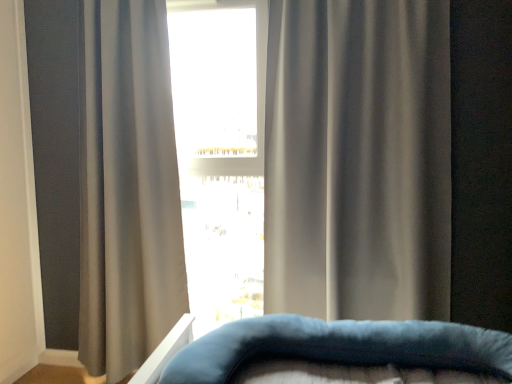
Question: Is satin gray curtain at center, which ranks as the second curtain in left-to-right order, oriented away from velvety blue pillow at center?

Choices:
 (A) no
 (B) yes

Answer: (A)

Question: Does satin gray curtain at center, placed as the first curtain when sorted from right to left, lie in front of velvety blue pillow at center?

Choices:
 (A) yes
 (B) no

Answer: (B)

Question: Does satin gray curtain at center, which ranks as the second curtain in left-to-right order, have a greater width compared to velvety blue pillow at center?

Choices:
 (A) yes
 (B) no

Answer: (B)

Question: Does satin gray curtain at center, placed as the first curtain when sorted from right to left, have a lesser width compared to velvety blue pillow at center?

Choices:
 (A) yes
 (B) no

Answer: (A)

Question: Is satin gray curtain at center, which ranks as the second curtain in left-to-right order, bigger than velvety blue pillow at center?

Choices:
 (A) yes
 (B) no

Answer: (A)

Question: From a real-world perspective, is velvety blue pillow at center under gray matte curtain at center, placed as the 1th curtain when sorted from left to right?

Choices:
 (A) no
 (B) yes

Answer: (B)

Question: Does velvety blue pillow at center appear on the left side of gray matte curtain at center, the 2th curtain viewed from the right?

Choices:
 (A) no
 (B) yes

Answer: (A)

Question: Is velvety blue pillow at center to the right of gray matte curtain at center, placed as the 1th curtain when sorted from left to right, from the viewer's perspective?

Choices:
 (A) yes
 (B) no

Answer: (A)

Question: Can you confirm if velvety blue pillow at center is thinner than gray matte curtain at center, placed as the 1th curtain when sorted from left to right?

Choices:
 (A) no
 (B) yes

Answer: (A)

Question: Can you confirm if velvety blue pillow at center is shorter than gray matte curtain at center, placed as the 1th curtain when sorted from left to right?

Choices:
 (A) no
 (B) yes

Answer: (B)

Question: Does velvety blue pillow at center have a greater width compared to gray matte curtain at center, the 2th curtain viewed from the right?

Choices:
 (A) yes
 (B) no

Answer: (A)

Question: Does gray matte curtain at center, placed as the 1th curtain when sorted from left to right, lie behind white glossy window at center?

Choices:
 (A) yes
 (B) no

Answer: (B)